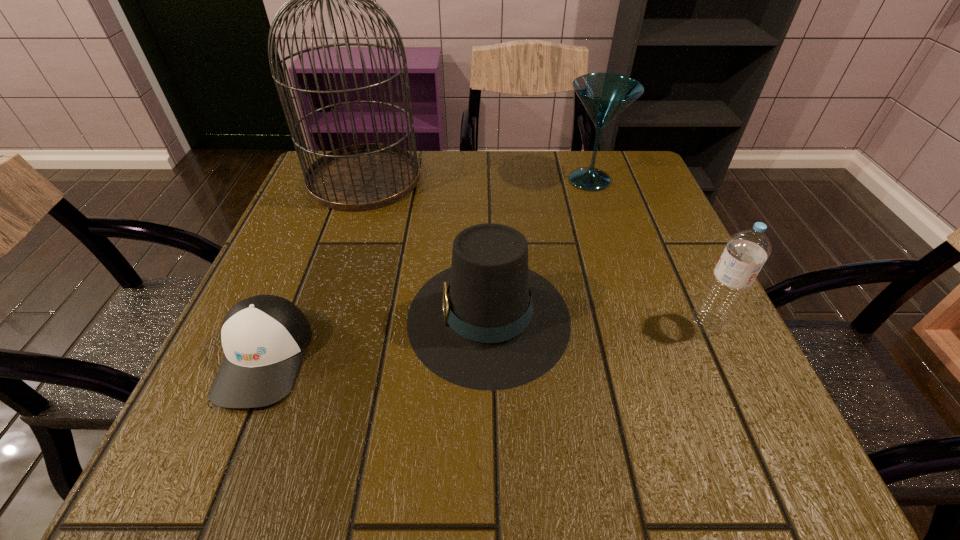
Locate an element on the screen. vacant space positioned 0.260m on the front-facing side of the fourth tallest object is located at coordinates (258, 317).

This screenshot has width=960, height=540. In order to click on free region located 0.290m on the front-facing side of the fourth tallest object in this screenshot , I will do `click(241, 317)`.

Locate an element on the screen. The width and height of the screenshot is (960, 540). vacant region located on the front panel of the cap is located at coordinates (226, 453).

The width and height of the screenshot is (960, 540). Identify the location of birdcage that is at the far edge. (361, 177).

Find the location of a particular element. martini situated at the far edge is located at coordinates (604, 95).

The width and height of the screenshot is (960, 540). Find the location of `birdcage present at the left edge`. birdcage present at the left edge is located at coordinates (361, 177).

You are a GUI agent. You are given a task and a screenshot of the screen. Output one action in this format:
    pyautogui.click(x=<x>, y=<y>)
    Task: Click on the cap that is at the left edge
    
    Given the screenshot: What is the action you would take?
    pyautogui.click(x=264, y=337)

At what (x,y) coordinates should I click in order to perform the action: click on martini at the right edge. Please return your answer as a coordinate pair (x, y). The height and width of the screenshot is (540, 960). Looking at the image, I should click on (604, 95).

What are the coordinates of `water bottle present at the right edge` in the screenshot? It's located at pyautogui.click(x=746, y=251).

The height and width of the screenshot is (540, 960). Identify the location of object that is at the far left corner. (361, 177).